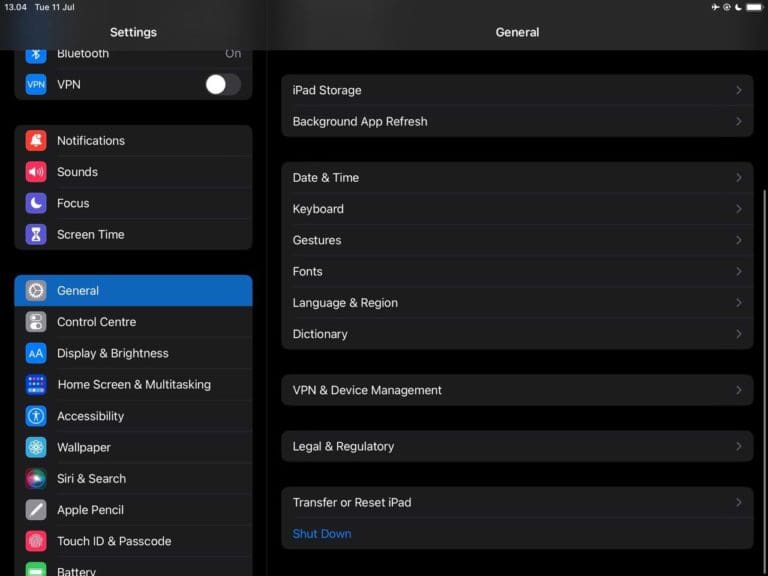
You are a GUI agent. You are given a task and a screenshot of the screen. Output one action in this format:
    pyautogui.click(x=<x>, y=<y>)
    Task: Click on the wallpaper button
    The width and height of the screenshot is (768, 576).
    Given the screenshot: What is the action you would take?
    pyautogui.click(x=111, y=444)